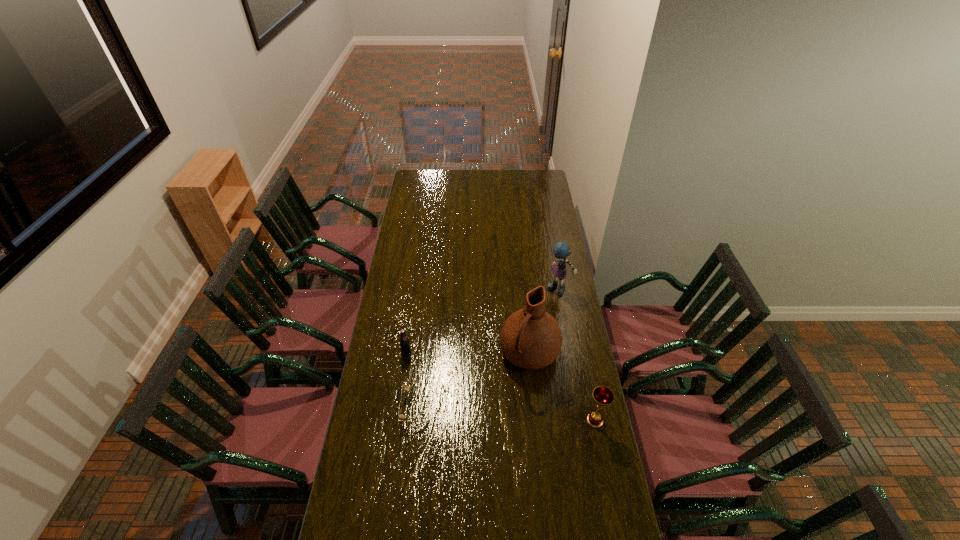
Identify the location of pitcher that is positioned at the right edge. (530, 338).

Locate an element on the screen. The width and height of the screenshot is (960, 540). rag doll that is positioned at the right edge is located at coordinates (561, 250).

Locate an element on the screen. vacant space at the far edge of the desktop is located at coordinates (450, 182).

I want to click on vacant space at the left edge, so click(410, 261).

In the image, there is a desktop. Identify the location of vacant region at the right edge. (575, 495).

Find the location of `vacant space at the far left corner of the desktop`. vacant space at the far left corner of the desktop is located at coordinates (422, 185).

Find the location of `free space that is in between the sunglasses and the pop`. free space that is in between the sunglasses and the pop is located at coordinates (414, 381).

Find the location of a particular element. free space between the second tallest object and the fourth tallest object is located at coordinates (483, 321).

Find the location of `vacant point located between the pop and the tallest object`. vacant point located between the pop and the tallest object is located at coordinates (468, 353).

In order to click on free space between the pop and the chalice in this screenshot , I will do `click(501, 387)`.